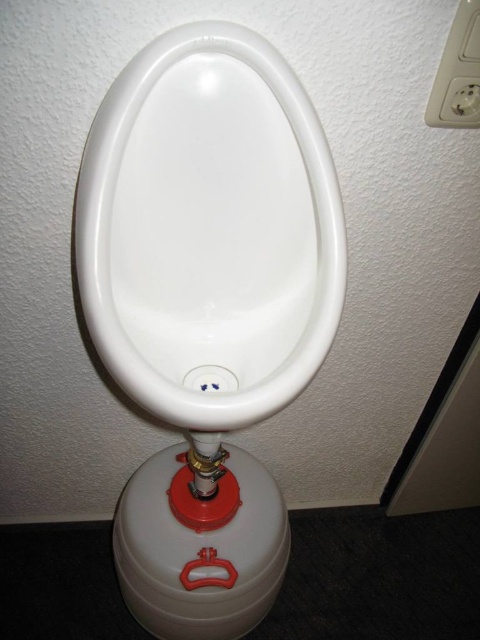
You are a plumber inspecting this makeshift plumbing system. You notice the white glossy urinal at center and the white plastic outlet at upper right. Which object is positioned higher up on the wall?

The white plastic outlet at upper right is positioned higher up on the wall than the white glossy urinal at center.

Looking at this image, you are a plumber inspecting a makeshift plumbing system. You notice the white glossy urinal at center and the white plastic outlet at upper right. Which object is bigger in size?

The white glossy urinal at center is larger in size compared to the white plastic outlet at upper right.